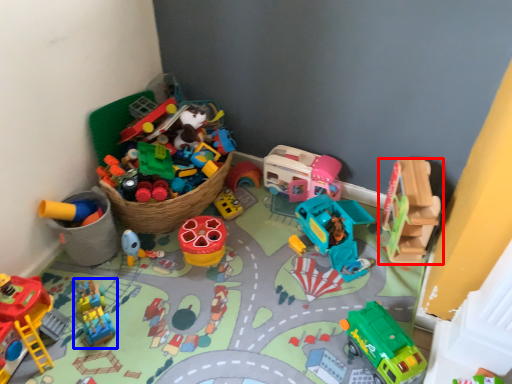
Question: Which point is closer to the camera, toy (highlighted by a red box) or toy (highlighted by a blue box)?

Choices:
 (A) toy
 (B) toy

Answer: (B)